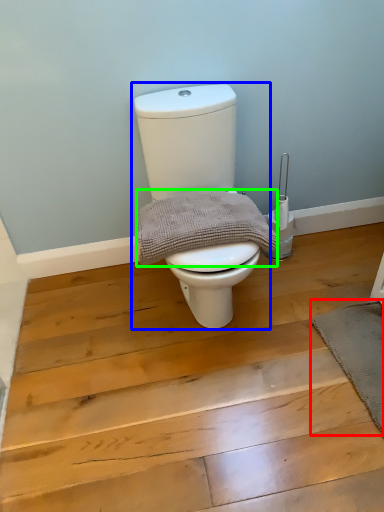
Question: Which object is positioned closest to bath mat (highlighted by a red box)? Select from toilet (highlighted by a blue box) and material (highlighted by a green box).

Choices:
 (A) toilet
 (B) material

Answer: (B)